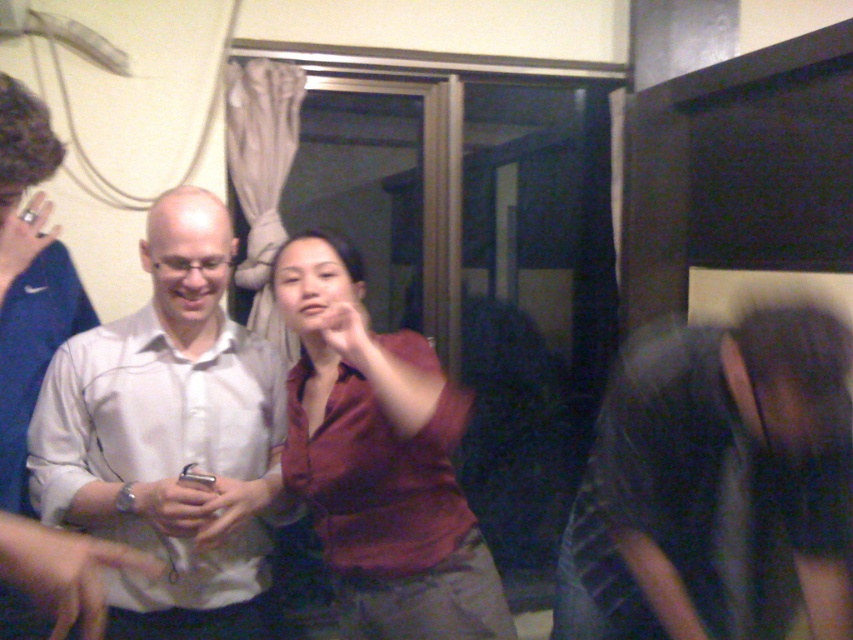
Consider the image. Between white matte shirt at center and matte red shirt at center, which one has less height?

matte red shirt at center is shorter.

Does white matte shirt at center appear over matte red shirt at center?

Correct, white matte shirt at center is located above matte red shirt at center.

What do you see at coordinates (165, 433) in the screenshot? This screenshot has height=640, width=853. I see `white matte shirt at center` at bounding box center [165, 433].

You are a GUI agent. You are given a task and a screenshot of the screen. Output one action in this format:
    pyautogui.click(x=<x>, y=<y>)
    Task: Click on the white matte shirt at center
    This screenshot has height=640, width=853.
    Given the screenshot: What is the action you would take?
    pyautogui.click(x=165, y=433)

Does dark blue jeans at lower right have a lesser height compared to white matte shirt at center?

Correct, dark blue jeans at lower right is not as tall as white matte shirt at center.

Is point (838, 428) closer to camera compared to point (108, 492)?

Yes, point (838, 428) is in front of point (108, 492).

Image resolution: width=853 pixels, height=640 pixels. What do you see at coordinates (717, 484) in the screenshot?
I see `dark blue jeans at lower right` at bounding box center [717, 484].

The width and height of the screenshot is (853, 640). What are the coordinates of `dark blue jeans at lower right` in the screenshot? It's located at click(x=717, y=484).

Is point (849, 586) positioned after point (422, 608)?

No, it is not.

Is point (778, 570) closer to camera compared to point (352, 403)?

Yes, it is.

Is point (737, 444) behind point (421, 515)?

No, (737, 444) is closer to viewer.

Identify the location of dark blue jeans at lower right. tap(717, 484).